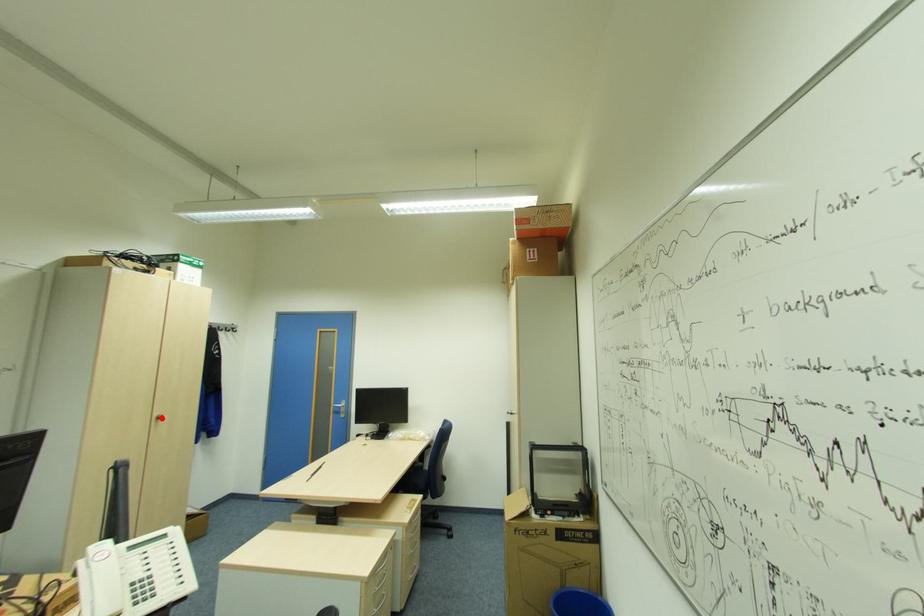
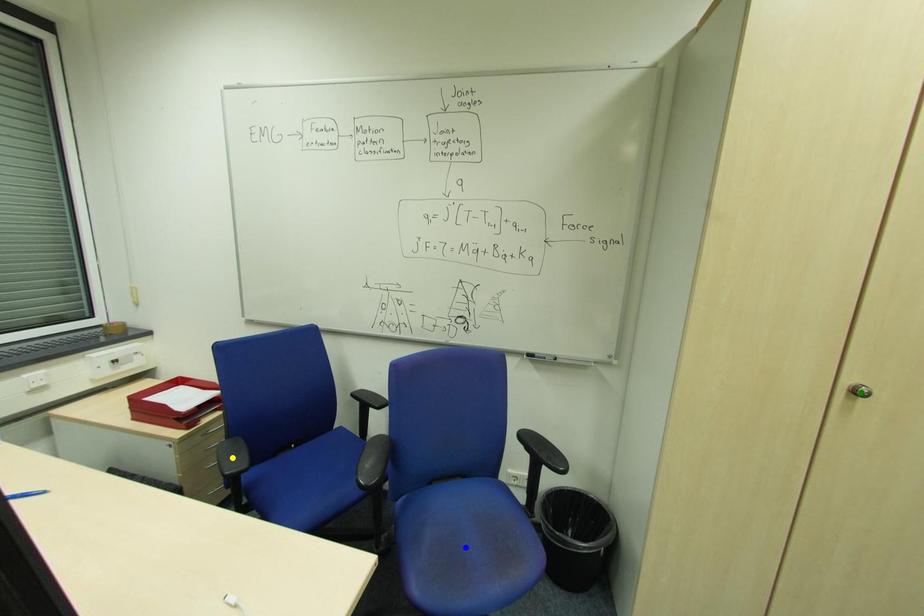
Question: I am providing you with two images of the same scene from different viewpoints. A red point is marked on the first image. You are given multiple points on the second image. Can you choose the point in image 2 that corresponds to the point in image 1?

Choices:
 (A) green point
 (B) yellow point
 (C) blue point

Answer: (A)